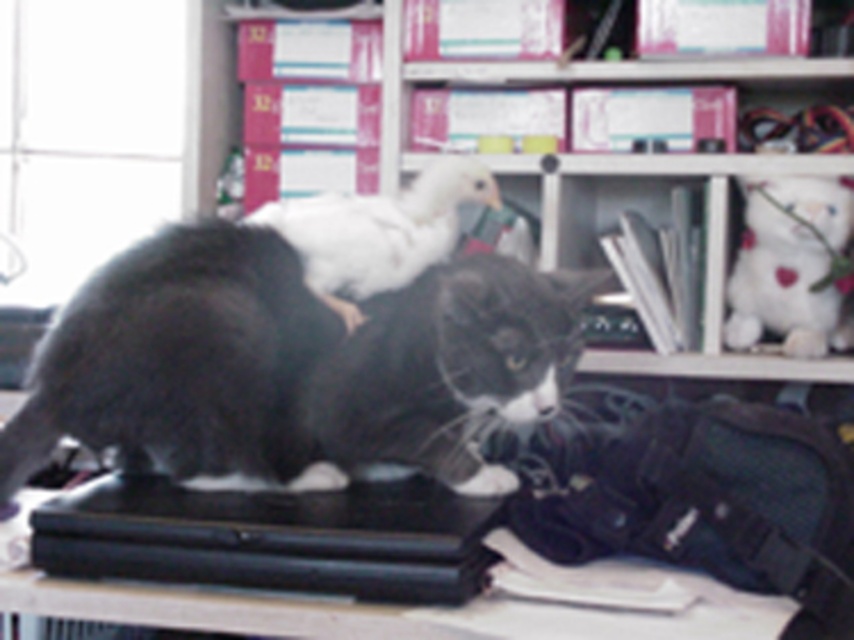
This screenshot has width=854, height=640. Find the location of `black matte laptop at center`. black matte laptop at center is located at coordinates (272, 538).

Is black matte laptop at center closer to the viewer compared to white plush toy at upper right?

Yes, black matte laptop at center is in front of white plush toy at upper right.

Image resolution: width=854 pixels, height=640 pixels. I want to click on black matte laptop at center, so click(x=272, y=538).

Which is more to the left, pink cardboard boxes at upper center or white fluffy duckling at center?

white fluffy duckling at center

Is pink cardboard boxes at upper center to the left of white fluffy duckling at center from the viewer's perspective?

Incorrect, pink cardboard boxes at upper center is not on the left side of white fluffy duckling at center.

What are the coordinates of `pink cardboard boxes at upper center` in the screenshot? It's located at [x=705, y=248].

Is black fur cat at center to the left of white plush toy at upper right from the viewer's perspective?

Yes, black fur cat at center is to the left of white plush toy at upper right.

Who is shorter, black fur cat at center or white plush toy at upper right?

Standing shorter between the two is white plush toy at upper right.

Does point (54, 328) lie behind point (835, 304)?

No, (54, 328) is in front of (835, 304).

Where is `black fur cat at center`? The image size is (854, 640). black fur cat at center is located at coordinates (291, 365).